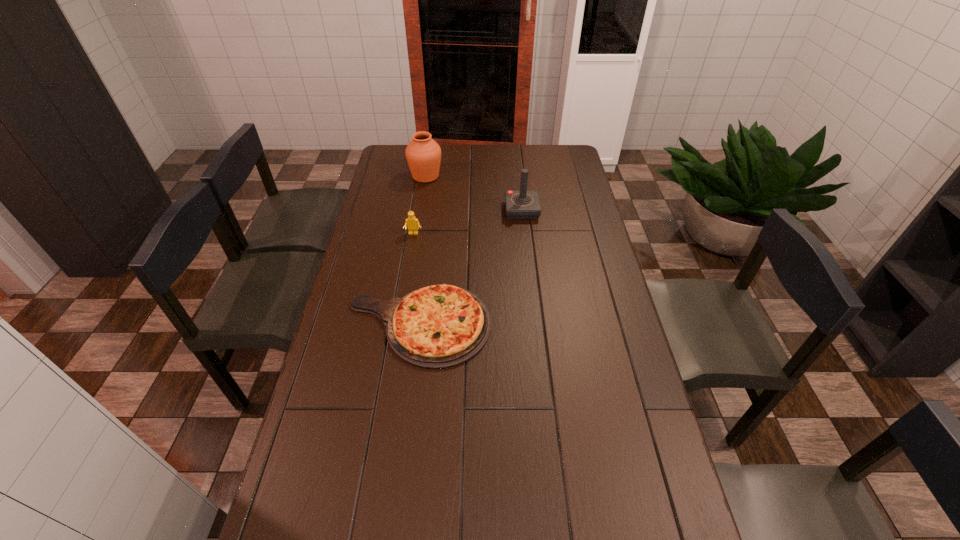
The image size is (960, 540). Find the location of `free spot between the farthest object and the shortest object`. free spot between the farthest object and the shortest object is located at coordinates (422, 251).

I want to click on free point between the pizza and the joystick, so click(470, 267).

In order to click on free space between the pizza and the third tallest object in this screenshot , I will do `click(416, 279)`.

Locate an element on the screen. free space between the pizza and the second shortest object is located at coordinates (x=416, y=279).

You are a GUI agent. You are given a task and a screenshot of the screen. Output one action in this format:
    pyautogui.click(x=<x>, y=<y>)
    Task: Click on the free point between the shortest object and the second shortest object
    This screenshot has width=960, height=540.
    Given the screenshot: What is the action you would take?
    pyautogui.click(x=416, y=279)

The height and width of the screenshot is (540, 960). Find the location of `vacant area that lies between the Lego and the third nearest object`. vacant area that lies between the Lego and the third nearest object is located at coordinates (468, 222).

Image resolution: width=960 pixels, height=540 pixels. Find the location of `free space between the urn and the shortest object`. free space between the urn and the shortest object is located at coordinates (422, 251).

This screenshot has height=540, width=960. Find the location of `vacant space that's between the second shortest object and the farthest object`. vacant space that's between the second shortest object and the farthest object is located at coordinates (420, 205).

Locate an element on the screen. empty space between the pizza and the second shortest object is located at coordinates (416, 279).

Identify which object is the third nearest to the urn. Please provide its 2D coordinates. Your answer should be formatted as a tuple, i.e. [(x, y)], where the tuple contains the x and y coordinates of a point satisfying the conditions above.

[(440, 326)]